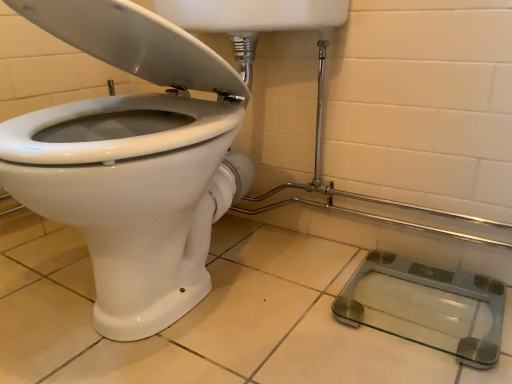
The width and height of the screenshot is (512, 384). Identify the location of vacant space that is to the left of transparent glass scale at lower right. (290, 305).